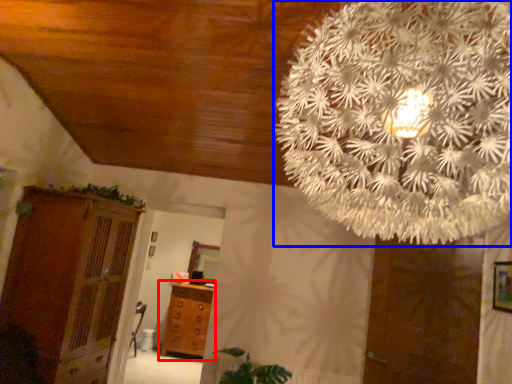
Question: Which of the following is the closest to the observer, chest of drawers (highlighted by a red box) or flower (highlighted by a blue box)?

Choices:
 (A) chest of drawers
 (B) flower

Answer: (B)